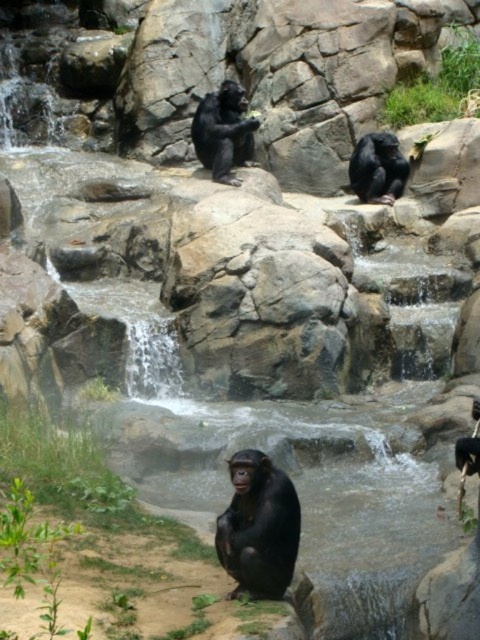
Looking at this image, you are a zookeeper observing the chimpanzees in their enclosure. You notice two monkeys, the black matte monkey at center and the shiny black monkey at upper center. Which one is positioned higher in the enclosure?

The black matte monkey at center is positioned higher than the shiny black monkey at upper center because it is above it.

You are a zookeeper standing at the entrance of the chimpanzee enclosure. You need to determine the distance between the shiny black monkey at center and the shiny black monkey at upper center. Can you estimate how far apart they are?

The shiny black monkey at center is 41.60 feet away from the shiny black monkey at upper center.